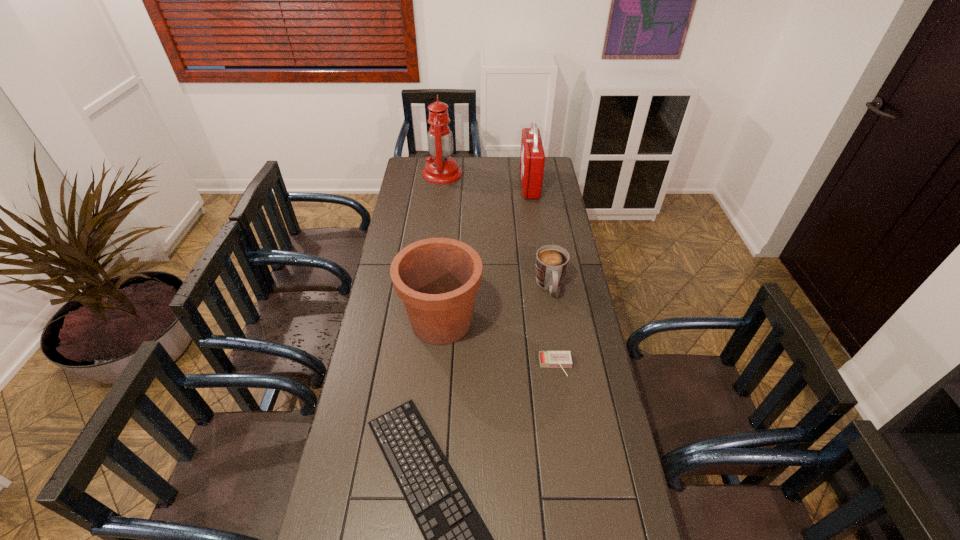
Identify the location of oil lamp. Image resolution: width=960 pixels, height=540 pixels. (441, 168).

At what (x,y) coordinates should I click in order to perform the action: click on the first-aid kit. Please return your answer as a coordinate pair (x, y). The width and height of the screenshot is (960, 540). Looking at the image, I should click on (532, 158).

The height and width of the screenshot is (540, 960). In order to click on the third tallest object in this screenshot , I will do `click(437, 279)`.

Locate an element on the screen. This screenshot has height=540, width=960. mug is located at coordinates (551, 265).

Find the location of a particular element. the fifth tallest object is located at coordinates (552, 359).

The height and width of the screenshot is (540, 960). In order to click on free point located on the front of the tallest object in this screenshot , I will do `click(437, 222)`.

The width and height of the screenshot is (960, 540). In order to click on vacant position located 0.250m on the front face of the first-aid kit in this screenshot , I will do `click(471, 184)`.

You are a GUI agent. You are given a task and a screenshot of the screen. Output one action in this format:
    pyautogui.click(x=<x>, y=<y>)
    Task: Click on the vacant position located 0.120m on the front face of the first-aid kit
    Image resolution: width=960 pixels, height=540 pixels.
    Given the screenshot: What is the action you would take?
    pyautogui.click(x=497, y=184)

This screenshot has height=540, width=960. In order to click on vacant area situated on the front face of the first-aid kit in this screenshot , I will do `click(445, 184)`.

Where is `free space located on the right of the flowerpot`? The image size is (960, 540). free space located on the right of the flowerpot is located at coordinates (550, 321).